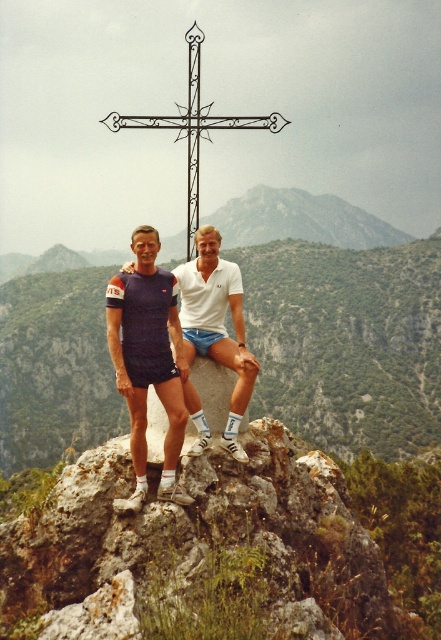
Can you confirm if matte blue shorts at center is thinner than wrought iron cross at center?

Correct, matte blue shorts at center's width is less than wrought iron cross at center's.

Is point (149, 253) farther from camera compared to point (201, 108)?

That is False.

Between point (115, 372) and point (198, 148), which one is positioned behind?

The point (115, 372) is more distant.

Image resolution: width=441 pixels, height=640 pixels. In order to click on matte blue shorts at center in this screenshot , I will do (x=149, y=362).

Based on the photo, is white cotton polo shirt at center closer to the viewer compared to black wrought iron cross at center?

Yes, white cotton polo shirt at center is closer to the viewer.

Is point (202, 436) positioned in front of point (197, 108)?

Yes, it is.

Does point (202, 324) come behind point (190, 246)?

No, it is in front of (190, 246).

Where is `white cotton polo shirt at center`? Image resolution: width=441 pixels, height=640 pixels. white cotton polo shirt at center is located at coordinates (216, 324).

Which is more to the right, wrought iron cross at center or black wrought iron cross at center?

Positioned to the right is wrought iron cross at center.

Does wrought iron cross at center appear over black wrought iron cross at center?

Yes.

This screenshot has height=640, width=441. I want to click on wrought iron cross at center, so click(x=194, y=125).